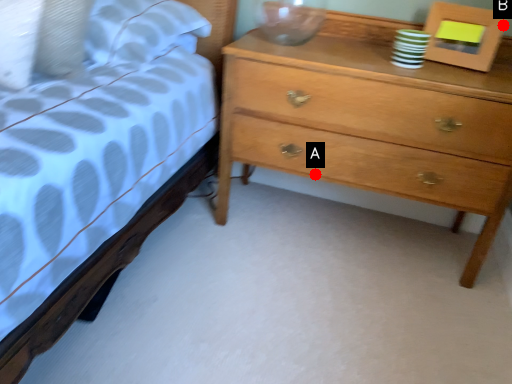
Question: Two points are circled on the image, labeled by A and B beside each circle. Which point is further to the camera?

Choices:
 (A) A is further
 (B) B is further

Answer: (A)